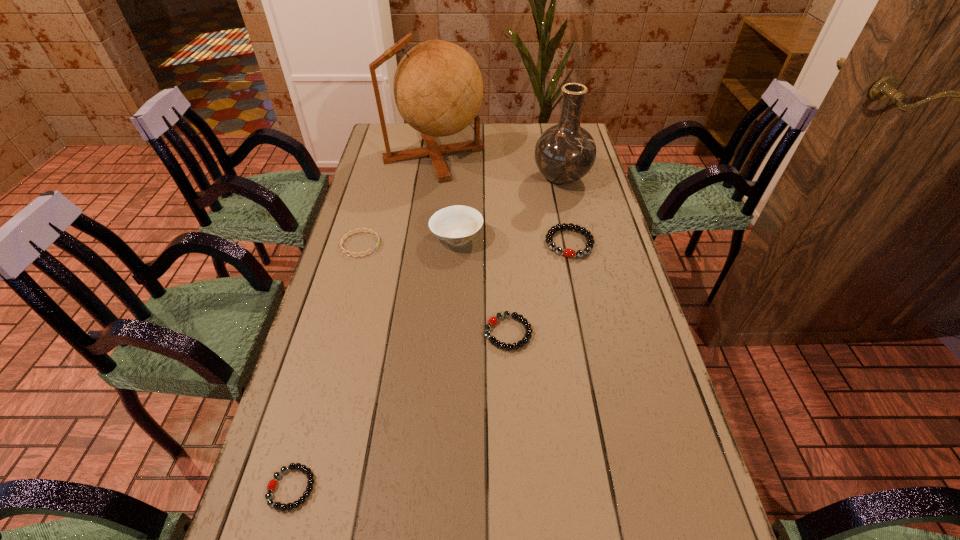
You are a GUI agent. You are given a task and a screenshot of the screen. Output one action in this format:
    pyautogui.click(x=<x>, y=<y>)
    Task: Click on the tallest object
    
    Given the screenshot: What is the action you would take?
    pyautogui.click(x=438, y=89)

Find the location of a particular element. Image resolution: width=960 pixels, height=540 pixels. vase is located at coordinates (564, 153).

Identify the location of beige bowl. The image size is (960, 540). (456, 225).

Where is `bowl`? The image size is (960, 540). bowl is located at coordinates (456, 225).

Locate an element on the screen. The image size is (960, 540). the farthest black bracelet is located at coordinates (567, 252).

You are a GUI agent. You are given a task and a screenshot of the screen. Output one action in this format:
    pyautogui.click(x=<x>, y=<y>)
    Task: Click on the fourth shortest object
    The width and height of the screenshot is (960, 540).
    Given the screenshot: What is the action you would take?
    pyautogui.click(x=567, y=252)

At what (x,y) coordinates should I click in order to perform the action: click on the second biggest black bracelet. Please return your answer as a coordinate pair (x, y). Looking at the image, I should click on (x=492, y=321).

The height and width of the screenshot is (540, 960). In order to click on the third shortest bracelet in this screenshot , I will do `click(492, 321)`.

In order to click on blue bracelet in this screenshot , I will do `click(369, 230)`.

Locate an element on the screen. the nearest black bracelet is located at coordinates (272, 484).